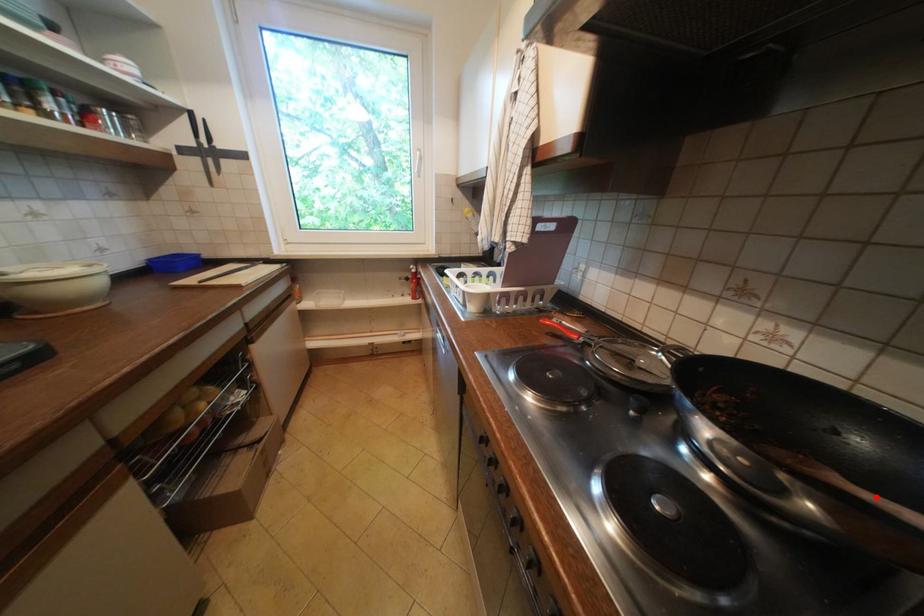
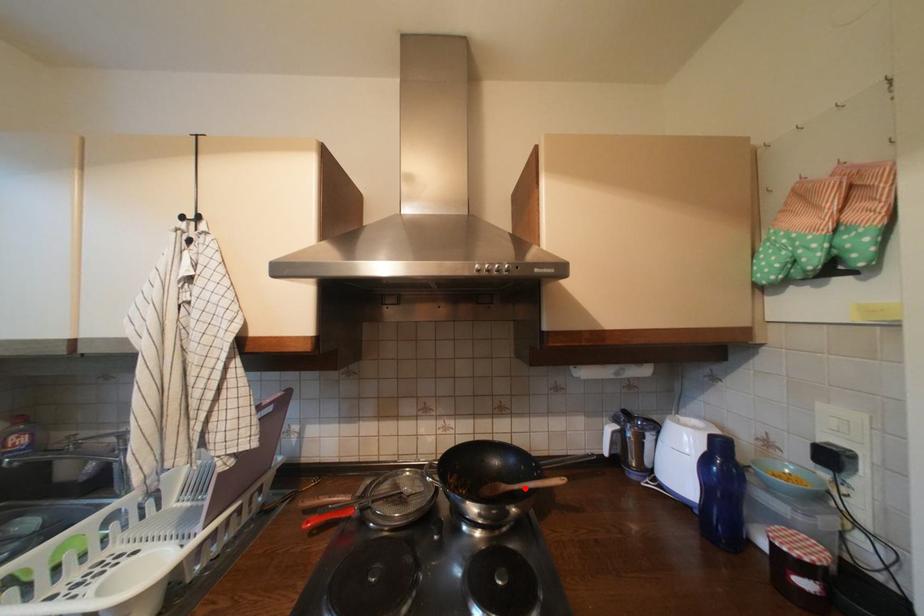
Consider the image. I am providing you with two images of the same scene from different viewpoints. A red point is marked on the first image and another point is marked on the second image. Is the red point in image1 aligned with the point shown in image2?

Yes